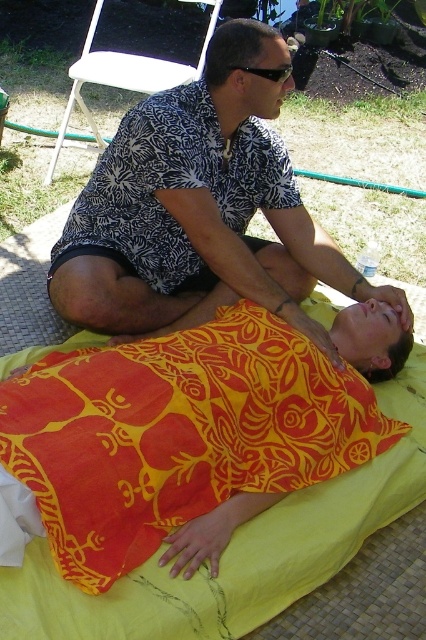
Question: Does yellow woven mat at lower center appear over black plastic sunglasses at upper center?

Choices:
 (A) yes
 (B) no

Answer: (B)

Question: Is yellow woven mat at lower center to the left of black plastic sunglasses at upper center from the viewer's perspective?

Choices:
 (A) yes
 (B) no

Answer: (B)

Question: Is printed fabric shirt at upper center to the right of yellow woven mat at lower center from the viewer's perspective?

Choices:
 (A) yes
 (B) no

Answer: (B)

Question: Which point appears closest to the camera in this image?

Choices:
 (A) (282, 77)
 (B) (222, 204)
 (C) (43, 589)

Answer: (C)

Question: Which of the following is the farthest from the observer?

Choices:
 (A) (377, 296)
 (B) (284, 80)
 (C) (339, 480)

Answer: (A)

Question: Which object appears farthest from the camera in this image?

Choices:
 (A) yellow woven mat at lower center
 (B) printed fabric shirt at upper center
 (C) black plastic sunglasses at upper center

Answer: (C)